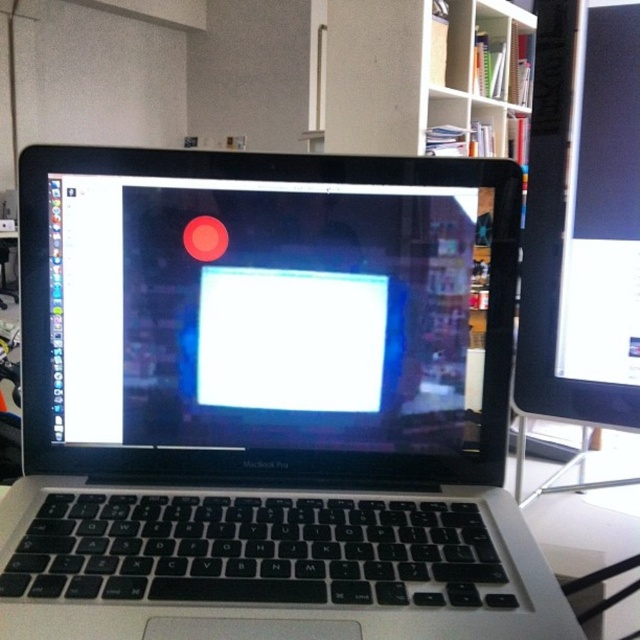
Who is positioned more to the right, silver/black plastic laptop at center or matte black monitor at right?

Positioned to the right is matte black monitor at right.

Is silver/black plastic laptop at center positioned before matte black monitor at right?

Yes, it is in front of matte black monitor at right.

Is point (323, 596) positioned after point (621, 102)?

That is False.

Where is `silver/black plastic laptop at center`? The width and height of the screenshot is (640, 640). silver/black plastic laptop at center is located at coordinates (264, 403).